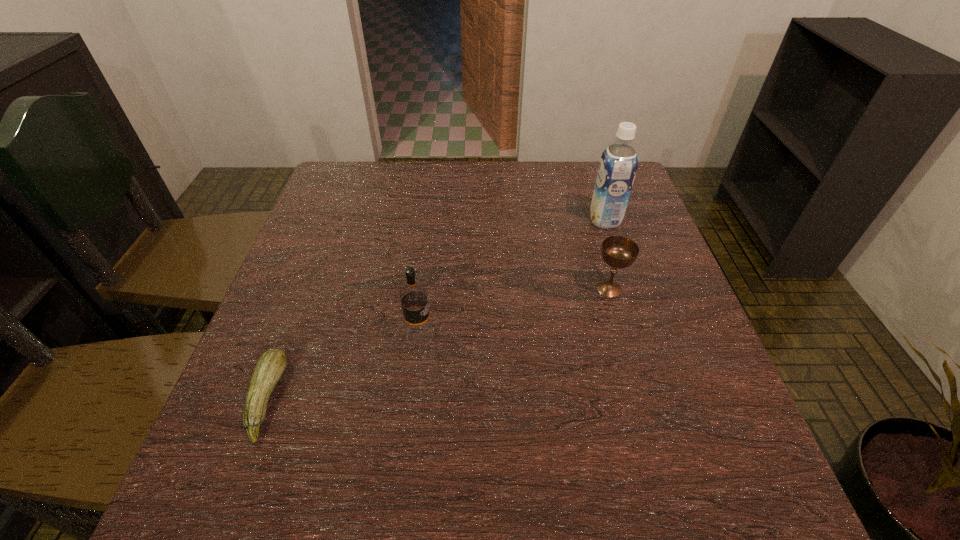
Identify which object is located as the third nearest to the tallest object. Please provide its 2D coordinates. Your answer should be formatted as a tuple, i.e. [(x, y)], where the tuple contains the x and y coordinates of a point satisfying the conditions above.

[(271, 365)]

You are a GUI agent. You are given a task and a screenshot of the screen. Output one action in this format:
    pyautogui.click(x=<x>, y=<y>)
    Task: Click on the third closest object to the second tallest object
    This screenshot has height=540, width=960.
    Given the screenshot: What is the action you would take?
    coord(618,164)

The width and height of the screenshot is (960, 540). What are the coordinates of `free point that satisfies the following two spatial constraints: 1. on the front side of the third tallest object; 2. at the stem end of the leftmost object` in the screenshot? It's located at (640, 399).